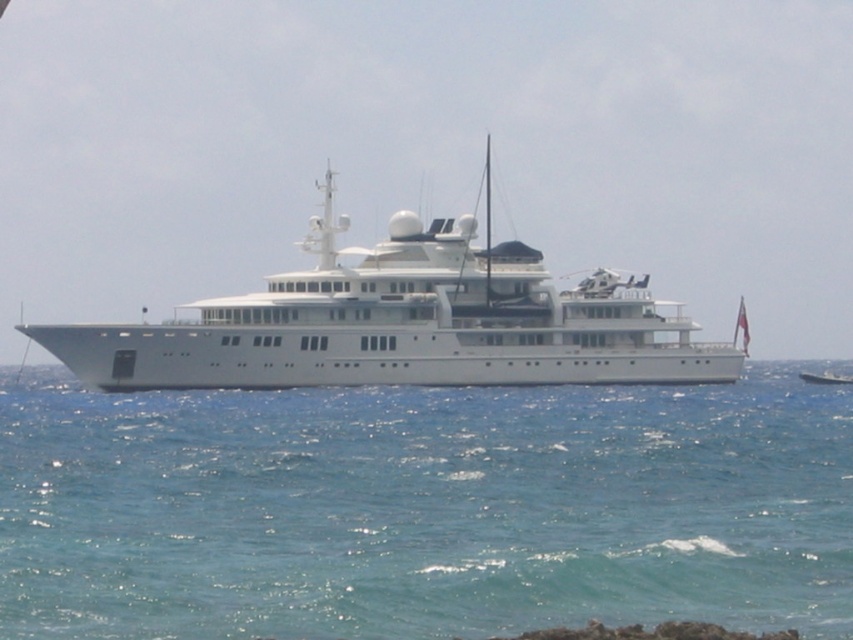
You are a photographer trying to capture the white glossy cruise ship at center from the clear blue water at center. Which object is closer to the camera lens? Please explain your reasoning based on their positions.

The clear blue water at center is in front of the white glossy cruise ship at center, so the clear blue water at center is closer to the camera lens.

You are a photographer trying to capture the white glossy yacht at center from the clear blue water at center. Since the water is taller than the yacht, will you need to adjust your camera angle upwards or downwards to frame the yacht properly?

The clear blue water at center is taller than the white glossy yacht at center, so to frame the yacht properly, you should adjust your camera angle downwards since the yacht is lower than the water level.

You are standing on the deck of the yacht and looking at two points marked on the image. The first point is at coordinates point (538, 257) and the second is at point (814, 381). Which point is nearer to your current position?

Point (538, 257) is closer to the camera than point (814, 381), so the first point is nearer to your current position.